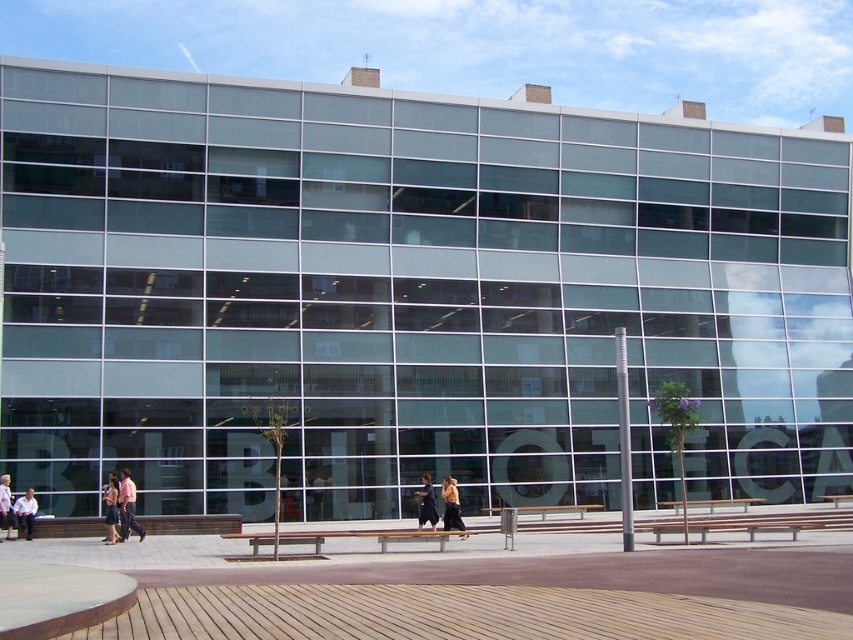
You are a visitor standing on the brown wooden bench at center. You want to move to the transparent glass benches at center. Which direction should you move to reach it?

The transparent glass benches at center is above the brown wooden bench at center, so you should move upward to reach it.

You are standing on the wooden deck in front of the modern building. You see the transparent glass benches at center and the dark blue jeans at center. Which object is located to the right when facing the building?

The transparent glass benches at center is to the right of dark blue jeans at center when facing the building.

You are a person who wants to sit on the benches in front of the modern building. Which bench would you need to look up slightly to sit on, the transparent glass benches at center or the brown wooden bench at center?

The transparent glass benches at center are taller than the brown wooden bench at center, so you would need to look up slightly to sit on the transparent glass benches at center.